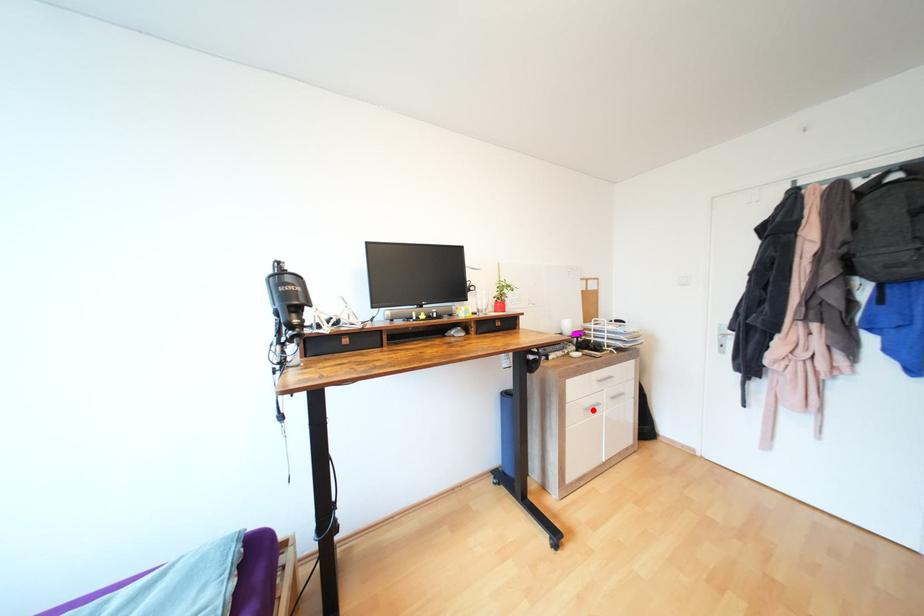
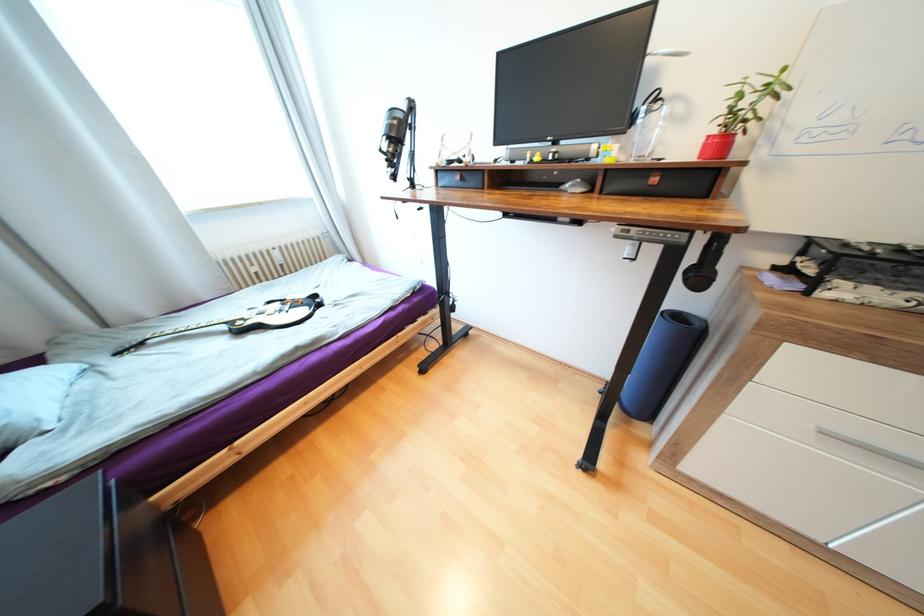
Locate, in the second image, the point that corresponds to the highlighted location in the first image.

(830, 432)